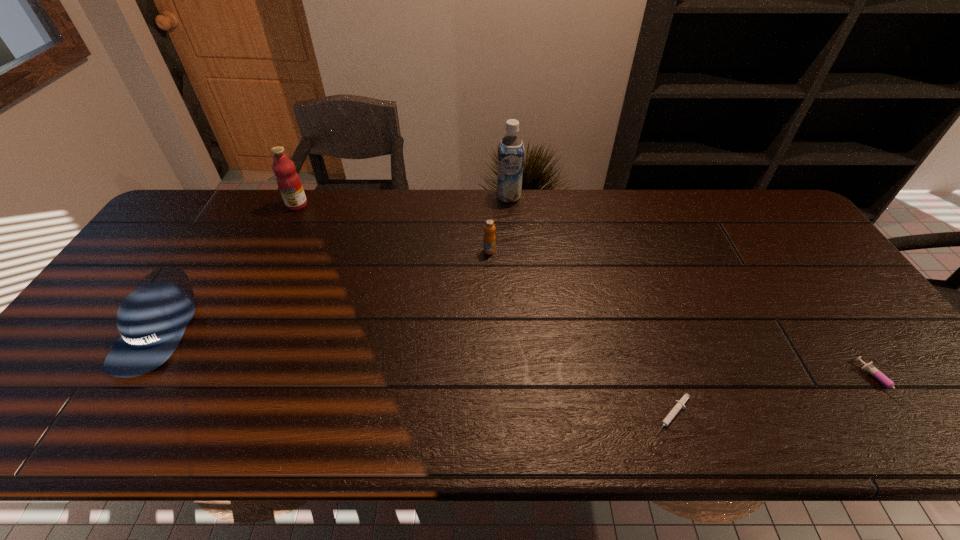
Where is `object that is at the right edge`? object that is at the right edge is located at coordinates (870, 368).

Where is `object located in the near right corner section of the desktop`? The width and height of the screenshot is (960, 540). object located in the near right corner section of the desktop is located at coordinates click(870, 368).

In the image, there is a desktop. At what (x,y) coordinates should I click in order to perform the action: click on vacant space at the far edge. Please return your answer as a coordinate pair (x, y). The height and width of the screenshot is (540, 960). Looking at the image, I should click on (349, 188).

Find the location of `vacant space at the near edge of the desktop`. vacant space at the near edge of the desktop is located at coordinates (727, 411).

Locate an element on the screen. The image size is (960, 540). vacant space at the left edge is located at coordinates (100, 399).

Locate an element on the screen. Image resolution: width=960 pixels, height=540 pixels. free region at the far left corner of the desktop is located at coordinates (192, 215).

At what (x,y) coordinates should I click in order to perform the action: click on vacant region at the near left corner of the desktop. Please return your answer as a coordinate pair (x, y). Looking at the image, I should click on (25, 407).

Find the location of a particular element. free space that is in between the tallest object and the rightmost object is located at coordinates (694, 289).

The width and height of the screenshot is (960, 540). In order to click on free space between the third farthest object and the soya milk in this screenshot , I will do `click(499, 224)`.

Find the location of `free area in between the second tallest object and the fourth nearest object`. free area in between the second tallest object and the fourth nearest object is located at coordinates (394, 228).